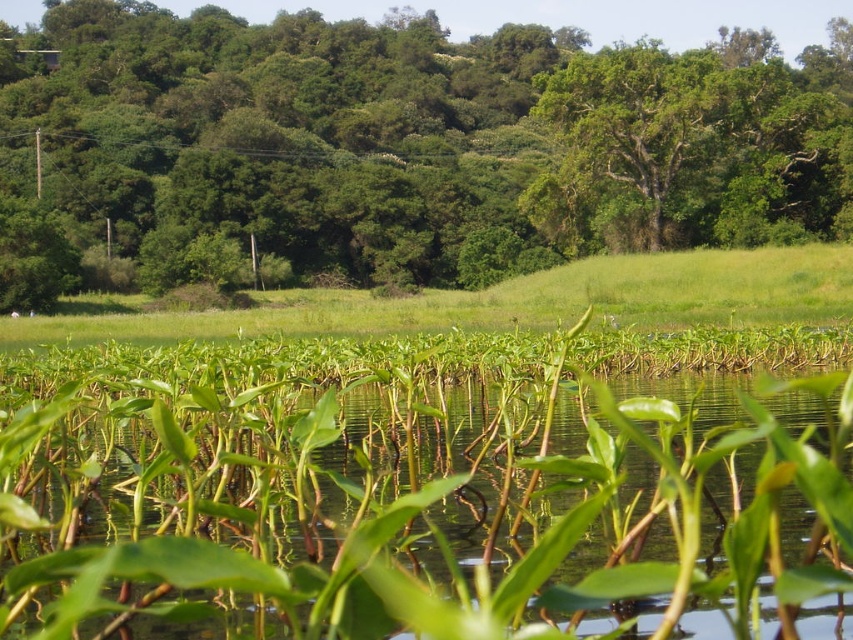
Question: Which point is closer to the camera?

Choices:
 (A) green grass at center
 (B) green leafy tree at center

Answer: (A)

Question: Can you confirm if green leafy tree at center is bigger than green grass at center?

Choices:
 (A) yes
 (B) no

Answer: (A)

Question: Where is green leafy tree at center located in relation to green grass at center in the image?

Choices:
 (A) below
 (B) above

Answer: (B)

Question: Which object is farther from the camera taking this photo?

Choices:
 (A) green leafy tree at center
 (B) green grass at center

Answer: (A)

Question: Does green leafy tree at center appear over green grass at center?

Choices:
 (A) yes
 (B) no

Answer: (A)